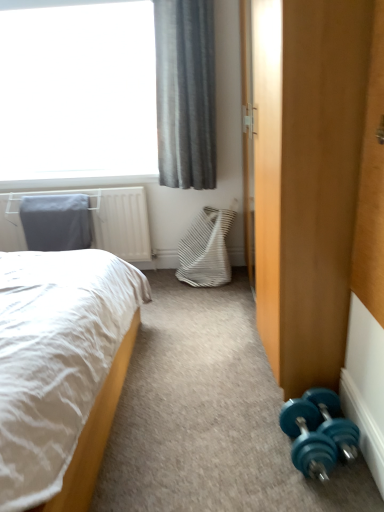
At what (x,y) coordinates should I click in order to perform the action: click on free space to the left of teal rubber dumbbell at lower right, which appears as the second dumbbell when viewed from the left. Please return your answer as a coordinate pair (x, y). Looking at the image, I should click on (254, 443).